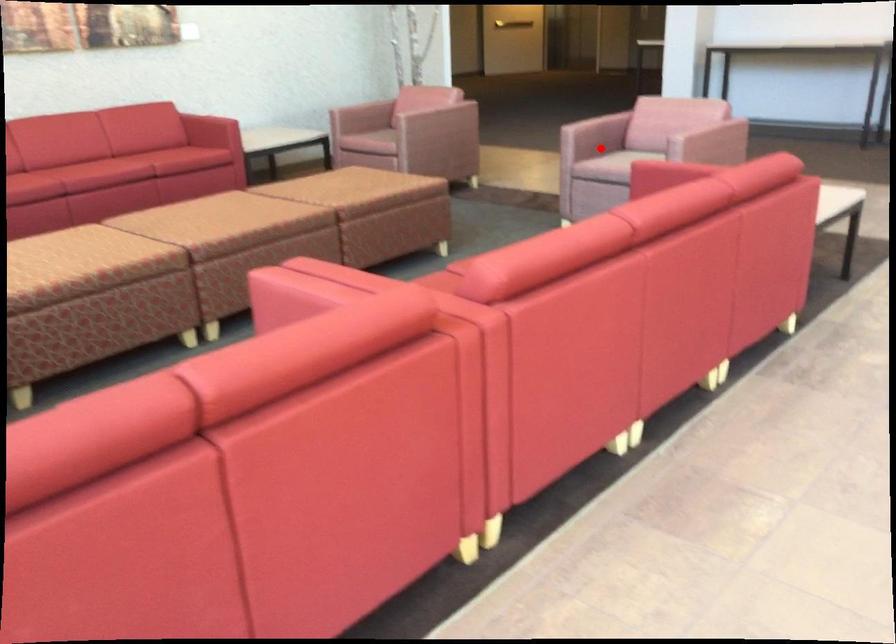
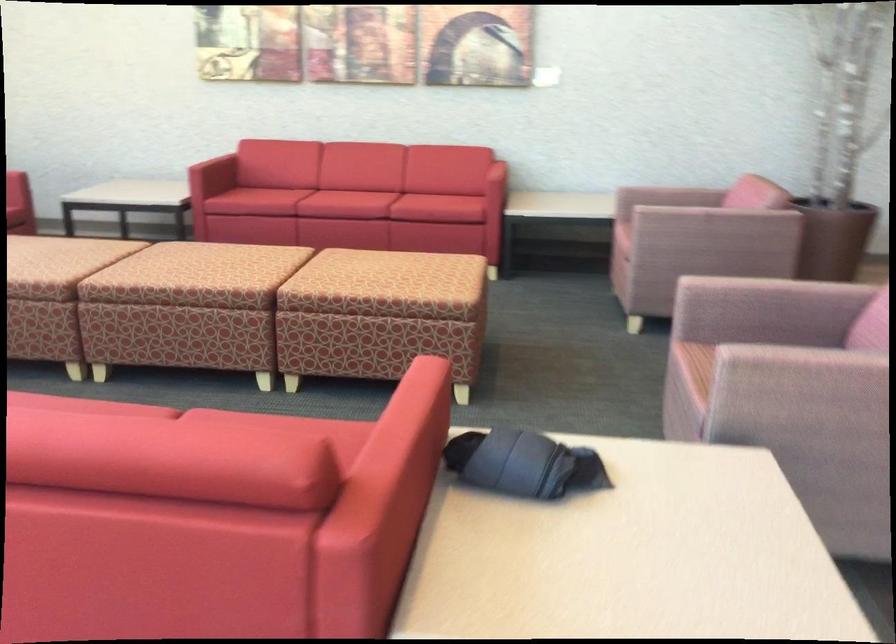
In the second image, find the point that corresponds to the highlighted location in the first image.

(760, 330)